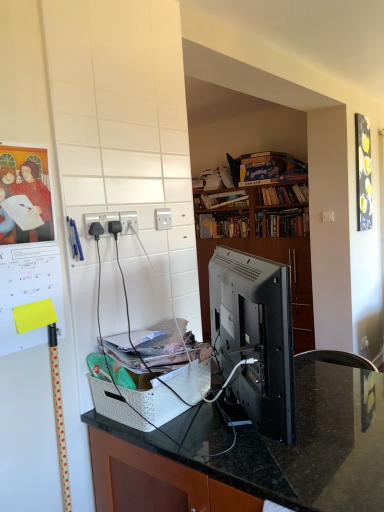
Question: Does hardcover book at upper center, the third book from the bottom, come in front of matte paper poster at upper left?

Choices:
 (A) yes
 (B) no

Answer: (B)

Question: Does hardcover book at upper center, the third book from the bottom, appear on the right side of matte paper poster at upper left?

Choices:
 (A) no
 (B) yes

Answer: (B)

Question: Is hardcover book at upper center, the third book from the bottom, positioned beyond the bounds of matte paper poster at upper left?

Choices:
 (A) no
 (B) yes

Answer: (B)

Question: From a real-world perspective, is hardcover book at upper center, marked as the fourth book in a top-to-bottom arrangement, physically below matte paper poster at upper left?

Choices:
 (A) yes
 (B) no

Answer: (B)

Question: Is hardcover book at upper center, marked as the fourth book in a top-to-bottom arrangement, to the left of matte paper poster at upper left from the viewer's perspective?

Choices:
 (A) no
 (B) yes

Answer: (A)

Question: Does hardcover book at upper center, the third book from the bottom, have a larger size compared to matte paper poster at upper left?

Choices:
 (A) no
 (B) yes

Answer: (B)

Question: Does hardcover book at upper center, the fifth book ordered from the bottom, have a lesser width compared to hardcover book at upper center, marked as the fourth book in a top-to-bottom arrangement?

Choices:
 (A) yes
 (B) no

Answer: (B)

Question: Is hardcover book at upper center, which is the 2th book from top to bottom, not near hardcover book at upper center, marked as the fourth book in a top-to-bottom arrangement?

Choices:
 (A) yes
 (B) no

Answer: (B)

Question: Is hardcover book at upper center, the fifth book ordered from the bottom, not inside hardcover book at upper center, the third book from the bottom?

Choices:
 (A) yes
 (B) no

Answer: (A)

Question: Is hardcover book at upper center, the fifth book ordered from the bottom, wider than hardcover book at upper center, marked as the fourth book in a top-to-bottom arrangement?

Choices:
 (A) no
 (B) yes

Answer: (B)

Question: From the image's perspective, is hardcover book at upper center, which is the 2th book from top to bottom, located beneath hardcover book at upper center, marked as the fourth book in a top-to-bottom arrangement?

Choices:
 (A) yes
 (B) no

Answer: (B)

Question: Is hardcover book at upper center, which is the 2th book from top to bottom, smaller than hardcover book at upper center, the third book from the bottom?

Choices:
 (A) yes
 (B) no

Answer: (A)

Question: Is the depth of hardcover book at center, the 5th book when ordered from top to bottom, less than that of black plastic power outlet at center, acting as the 3th electric outlet starting from the back?

Choices:
 (A) yes
 (B) no

Answer: (B)